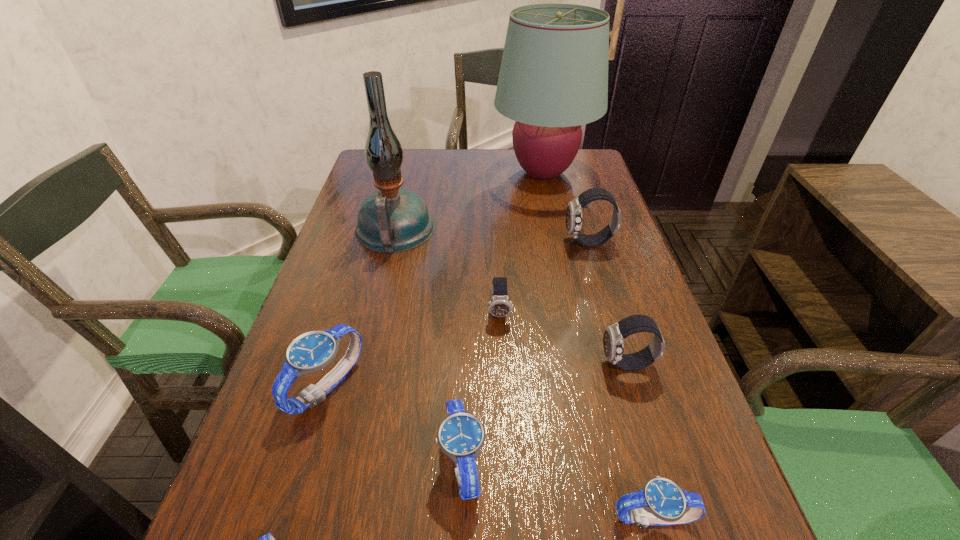
Where is `vacant space at the far left corner of the desktop`? This screenshot has width=960, height=540. vacant space at the far left corner of the desktop is located at coordinates (408, 171).

This screenshot has height=540, width=960. Find the location of `blank region between the blue lampshade and the second smallest dark watch`. blank region between the blue lampshade and the second smallest dark watch is located at coordinates (585, 269).

This screenshot has width=960, height=540. What are the coordinates of `unoccupied area between the sixth nearest watch and the oil lamp` in the screenshot? It's located at 447,271.

Where is `vacant area that lies between the farthest object and the biggest blue watch`? vacant area that lies between the farthest object and the biggest blue watch is located at coordinates (435, 280).

The width and height of the screenshot is (960, 540). I want to click on free point between the biggest dark watch and the biggest blue watch, so click(458, 314).

This screenshot has width=960, height=540. Identify the location of free spot between the oil lamp and the fourth farthest object. (447, 271).

Point out which object is positioned as the third nearest to the tallest watch. Please provide its 2D coordinates. Your answer should be formatted as a tuple, i.e. [(x, y)], where the tuple contains the x and y coordinates of a point satisfying the conditions above.

[(614, 335)]

Locate an element on the screen. The height and width of the screenshot is (540, 960). object that stands as the sixth closest to the farthest dark watch is located at coordinates (313, 351).

Identify the location of watch that stands as the sixth closest to the nearest dark watch. (268, 539).

Image resolution: width=960 pixels, height=540 pixels. I want to click on watch that can be found as the second closest to the second blue watch from right to left, so click(268, 539).